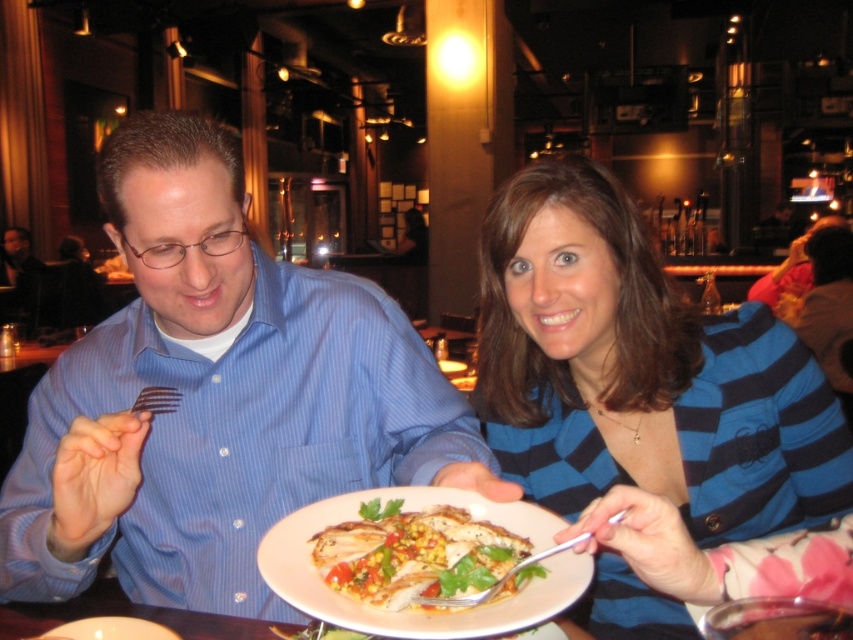
Question: Which of the following is the farthest from the observer?

Choices:
 (A) (154, 598)
 (B) (691, 628)
 (C) (502, 573)

Answer: (A)

Question: Does golden crispy chicken at center appear under silver metallic fork at plate center?

Choices:
 (A) no
 (B) yes

Answer: (B)

Question: Which of the following is the farthest from the observer?

Choices:
 (A) (173, 216)
 (B) (376, 588)
 (C) (695, 481)

Answer: (C)

Question: Can you confirm if blue striped sweater at center is bigger than golden crispy chicken at center?

Choices:
 (A) yes
 (B) no

Answer: (A)

Question: Which point appears farthest from the camera in this image?

Choices:
 (A) (480, 481)
 (B) (546, 477)
 (C) (428, 577)

Answer: (B)

Question: Observing the image, what is the correct spatial positioning of blue striped shirt at center in reference to golden crispy chicken at center?

Choices:
 (A) right
 (B) left

Answer: (B)